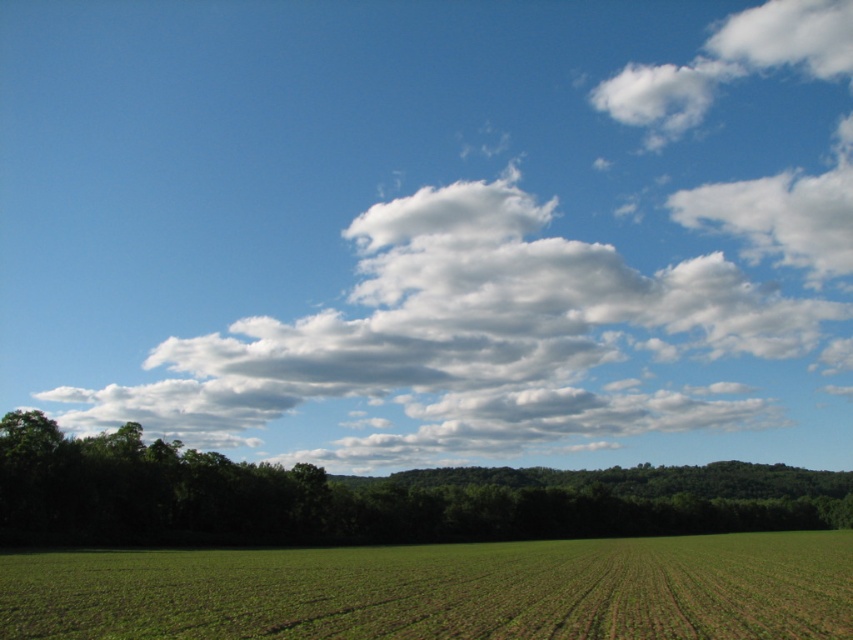
Question: Which is nearer to the white fluffy cloud at upper center?

Choices:
 (A) green leafy tree at lower center
 (B) green grass at lower center

Answer: (A)

Question: Is white fluffy cloud at upper center to the right of green leafy tree at lower center from the viewer's perspective?

Choices:
 (A) no
 (B) yes

Answer: (A)

Question: Is white fluffy cloud at upper center further to the viewer compared to green leafy tree at lower center?

Choices:
 (A) no
 (B) yes

Answer: (B)

Question: Can you confirm if white fluffy cloud at upper center is positioned above green grass at lower center?

Choices:
 (A) no
 (B) yes

Answer: (B)

Question: Among these objects, which one is farthest from the camera?

Choices:
 (A) green grass at lower center
 (B) white fluffy cloud at upper center
 (C) green leafy tree at lower center

Answer: (B)

Question: Which point appears farthest from the camera in this image?

Choices:
 (A) click(634, 77)
 (B) click(660, 428)

Answer: (A)